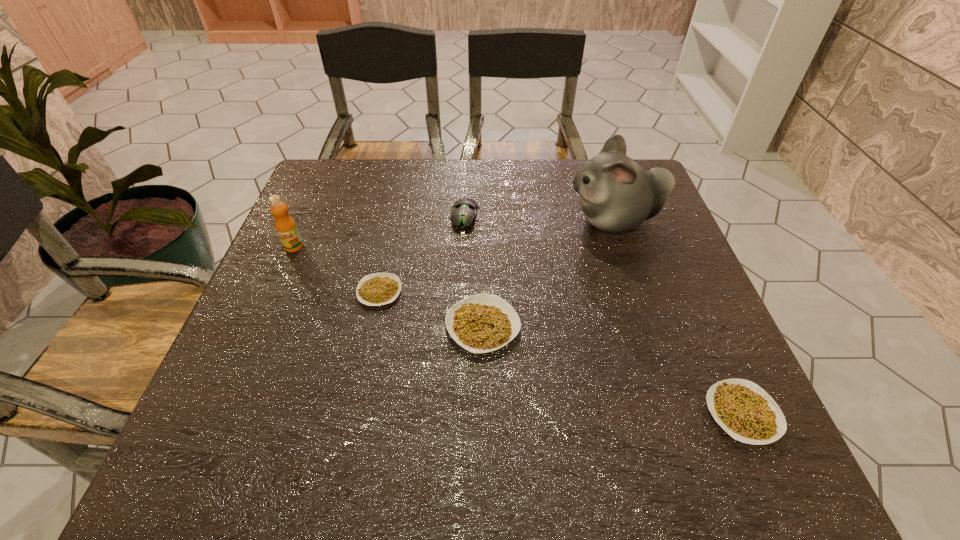
Identify the location of free space located 0.130m on the right of the second legume from left to right. (584, 326).

The image size is (960, 540). Find the location of `vacant position located on the left of the second shortest object`. vacant position located on the left of the second shortest object is located at coordinates (517, 414).

The width and height of the screenshot is (960, 540). In order to click on vacant region located on the face of the tallest object in this screenshot , I will do `click(516, 221)`.

Find the location of a particular element. vacant area located 0.320m on the face of the tallest object is located at coordinates (443, 221).

At what (x,y) coordinates should I click in order to perform the action: click on vacant position located on the face of the tallest object. Please return your answer as a coordinate pair (x, y). Image resolution: width=960 pixels, height=540 pixels. Looking at the image, I should click on (427, 221).

Locate an element on the screen. vacant space located on the front label of the orange juice is located at coordinates (249, 351).

The height and width of the screenshot is (540, 960). I want to click on free space located on the right of the computer mouse, so click(x=626, y=217).

The height and width of the screenshot is (540, 960). Identify the location of hamster positioned at the far edge. (617, 194).

The height and width of the screenshot is (540, 960). Identify the location of computer mouse that is at the far edge. (464, 211).

What are the coordinates of `object positioned at the near edge` in the screenshot? It's located at (743, 409).